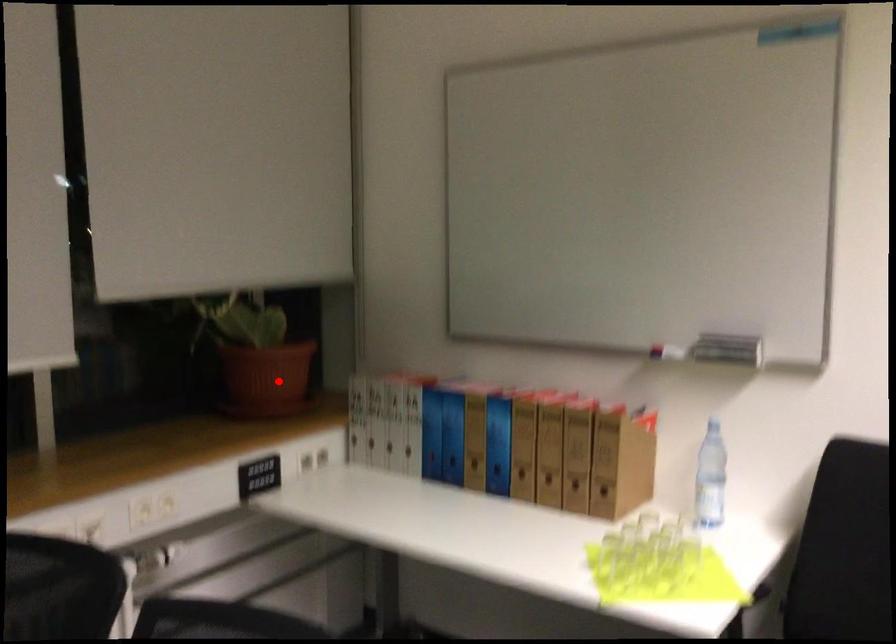
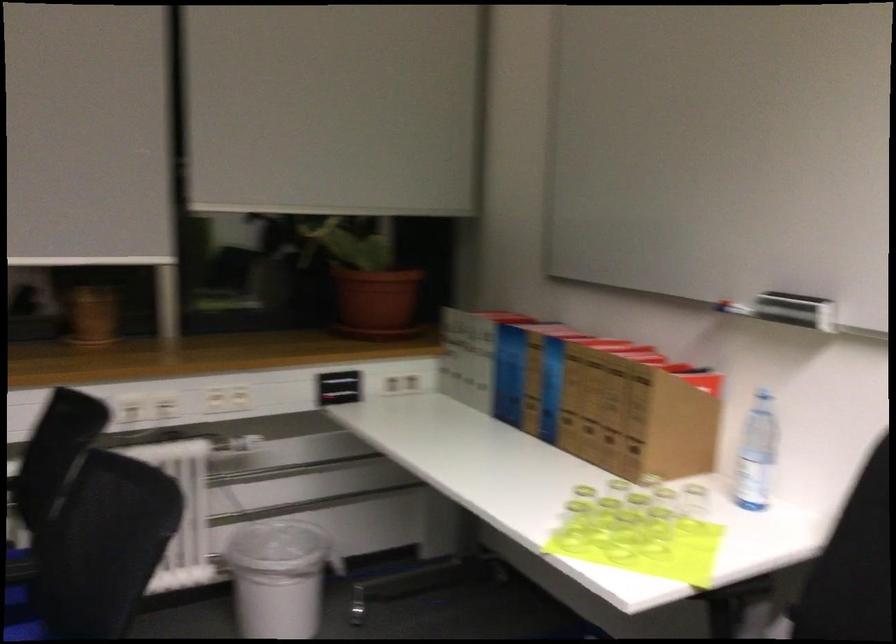
Where in the second image is the point corresponding to the highlighted location from the first image?

(375, 303)